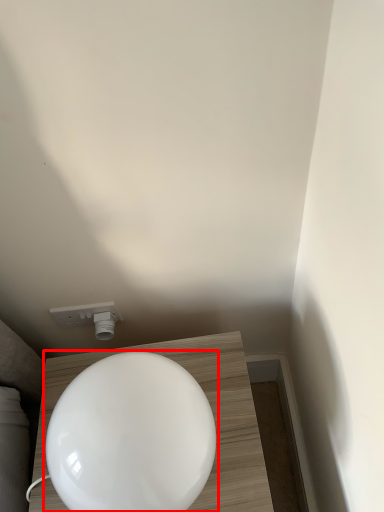
Question: Where is toilet (annotated by the red box) located in relation to light fixture in the image?

Choices:
 (A) right
 (B) left

Answer: (A)